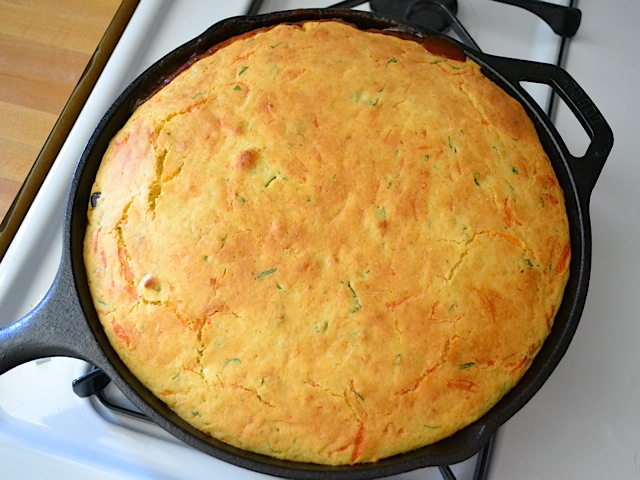
Locate an element on the screen. brown trimming around stove top is located at coordinates (67, 122).